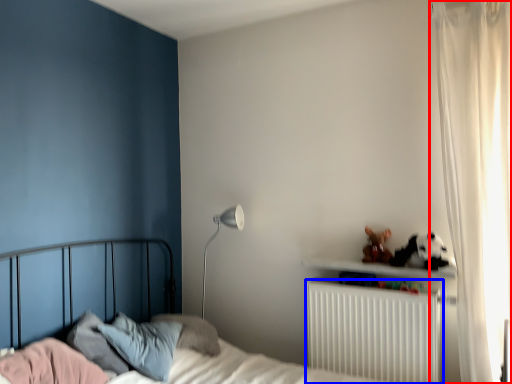
Question: Which of the following is the farthest to the observer, curtain (highlighted by a red box) or radiator (highlighted by a blue box)?

Choices:
 (A) curtain
 (B) radiator

Answer: (B)